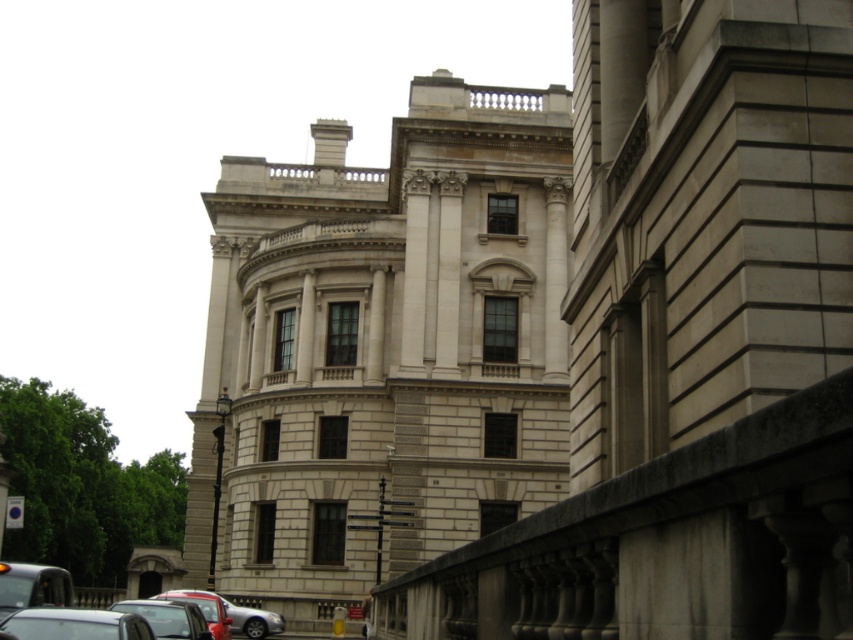
Can you confirm if matte black car at lower left is positioned to the right of shiny red car at lower left?

Incorrect, matte black car at lower left is not on the right side of shiny red car at lower left.

Does point (126, 611) come behind point (218, 621)?

That is False.

At what (x,y) coordinates should I click in order to perform the action: click on matte black car at lower left. Please return your answer as a coordinate pair (x, y). Looking at the image, I should click on (167, 618).

Between point (120, 620) and point (235, 612), which one is positioned behind?

The point (235, 612) is more distant.

At what (x,y) coordinates should I click in order to perform the action: click on metallic silver car at lower left. Please return your answer as a coordinate pair (x, y). Image resolution: width=853 pixels, height=640 pixels. Looking at the image, I should click on (74, 625).

Find the location of a particular element. metallic silver car at lower left is located at coordinates (74, 625).

Locate an element on the screen. The width and height of the screenshot is (853, 640). metallic silver car at lower left is located at coordinates [74, 625].

Can you confirm if silver metallic car at lower left is shorter than shiny red car at lower left?

Correct, silver metallic car at lower left is not as tall as shiny red car at lower left.

How far apart are silver metallic car at lower left and shiny red car at lower left?

21.56 feet

Which is behind, point (230, 616) or point (223, 637)?

Positioned behind is point (230, 616).

The width and height of the screenshot is (853, 640). Identify the location of silver metallic car at lower left. coord(252,620).